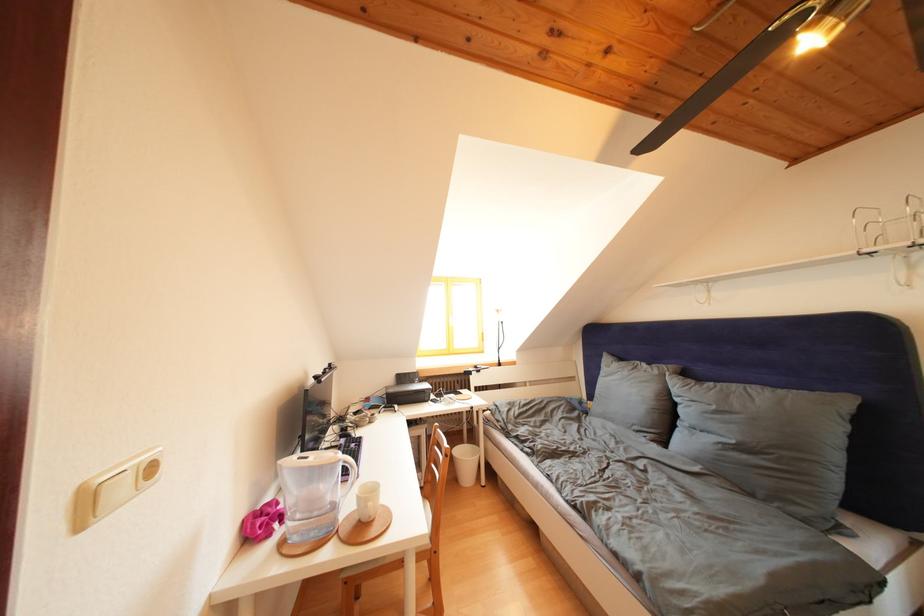
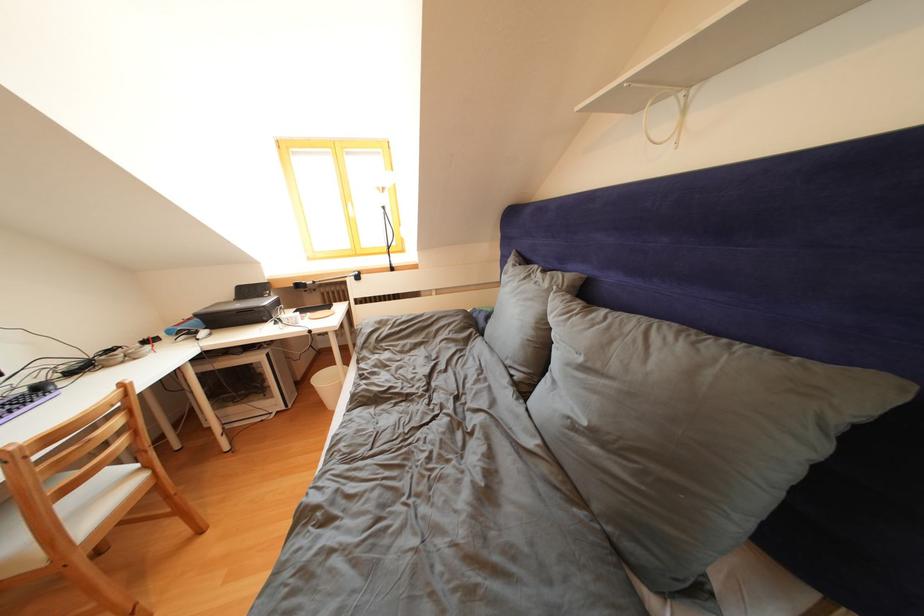
The images are taken continuously from a first-person perspective. In which direction are you moving?

The cameraman moved toward right, forward.